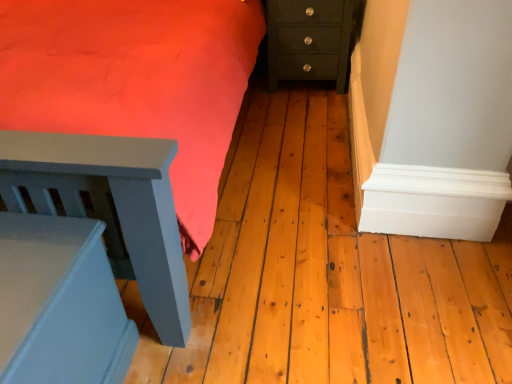
Where is `dark green textured chest of drawers at right`? The height and width of the screenshot is (384, 512). dark green textured chest of drawers at right is located at coordinates (312, 39).

What do you see at coordinates (312, 39) in the screenshot?
I see `dark green textured chest of drawers at right` at bounding box center [312, 39].

Identify the location of dark green textured chest of drawers at right. Image resolution: width=512 pixels, height=384 pixels. (312, 39).